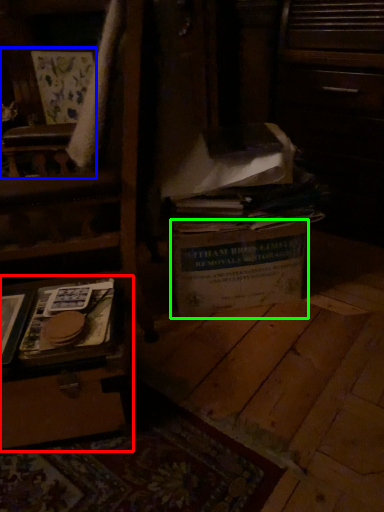
Question: Estimate the real-world distances between objects in this image. Which object is farther from vanity (highlighted by a red box), armchair (highlighted by a blue box) or cardboard box (highlighted by a green box)?

Choices:
 (A) armchair
 (B) cardboard box

Answer: (A)